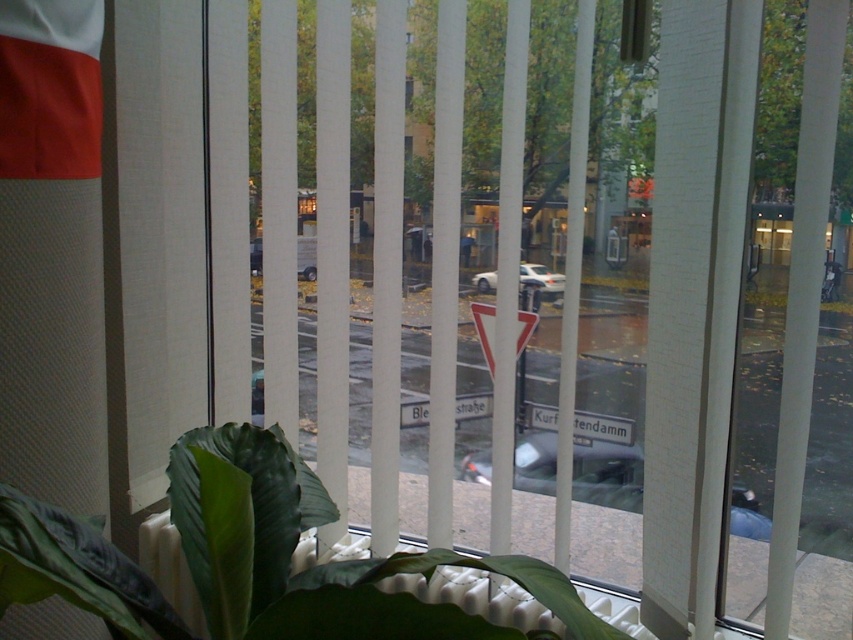
Question: Is the position of green matte leafy plant at lower center less distant than that of silver metallic car at center?

Choices:
 (A) yes
 (B) no

Answer: (A)

Question: Which object is closer to the camera taking this photo?

Choices:
 (A) silver metallic car at center
 (B) metallic silver car at center

Answer: (B)

Question: Can you confirm if transparent glass door at right is bigger than silver metallic car at center?

Choices:
 (A) no
 (B) yes

Answer: (B)

Question: Considering the real-world distances, which object is closest to the transparent glass door at right?

Choices:
 (A) metallic silver car at center
 (B) green matte leafy plant at lower center

Answer: (A)

Question: Among these points, which one is nearest to the camera?

Choices:
 (A) (514, 477)
 (B) (815, 566)
 (C) (550, 285)
 (D) (206, 557)

Answer: (D)

Question: Is metallic silver car at center bigger than silver metallic car at center?

Choices:
 (A) no
 (B) yes

Answer: (B)